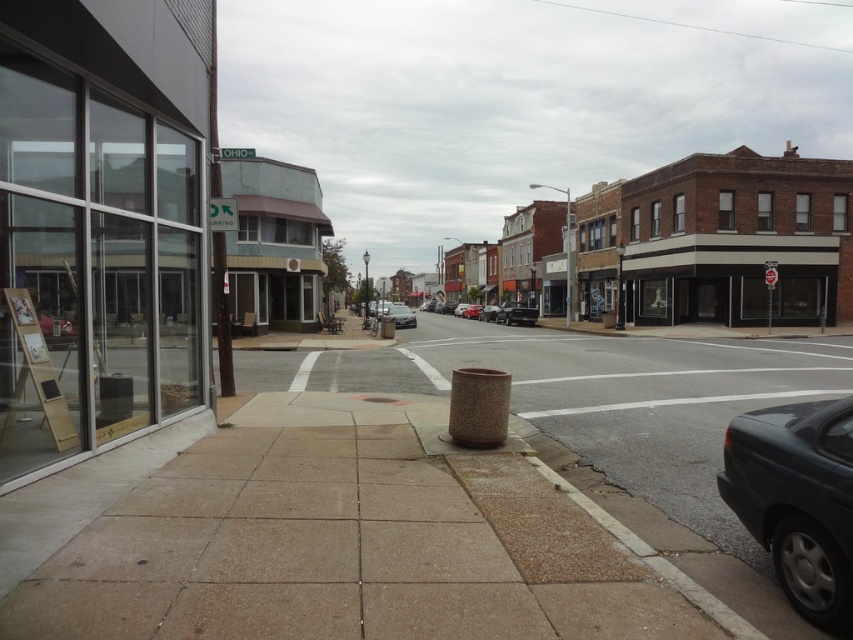
Is brown concrete sidewalk at center in front of matte black sedan at center?

Yes, it is.

How far apart are brown concrete sidewalk at center and matte black sedan at center?

The distance of brown concrete sidewalk at center from matte black sedan at center is 52.97 meters.

Is point (131, 573) positioned behind point (471, 307)?

No.

This screenshot has height=640, width=853. Find the location of `brown concrete sidewalk at center`. brown concrete sidewalk at center is located at coordinates (357, 545).

Is point (184, 96) positioned after point (751, 499)?

Yes, point (184, 96) is behind point (751, 499).

Can you confirm if clear glass storefront at left is thinner than dark gray metallic car at lower right?

No.

Which is in front, point (67, 348) or point (738, 458)?

Point (738, 458)

This screenshot has width=853, height=640. What are the coordinates of `clear glass storefront at left` in the screenshot? It's located at (99, 221).

Is brick building at center taller than dark gray metallic car at lower right?

Correct, brick building at center is much taller as dark gray metallic car at lower right.

Is brick building at center thinner than dark gray metallic car at lower right?

No, brick building at center is not thinner than dark gray metallic car at lower right.

Is point (753, 170) farther from viewer compared to point (824, 524)?

Yes, it is.

Locate an element on the screen. brick building at center is located at coordinates (718, 241).